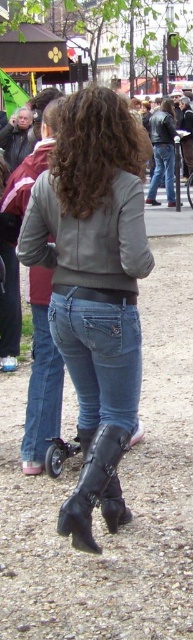
Question: Is leather jacket at center positioned in front of jeans at center?

Choices:
 (A) no
 (B) yes

Answer: (B)

Question: Estimate the real-world distances between objects in this image. Which object is closer to the blue denim jeans at center?

Choices:
 (A) denim at center
 (B) leather jacket at center
 (C) jeans at center

Answer: (A)

Question: Is jeans at center in front of black leather boot at lower center?

Choices:
 (A) yes
 (B) no

Answer: (B)

Question: Which point is closer to the camera taking this photo?

Choices:
 (A) (166, 152)
 (B) (126, 397)

Answer: (B)

Question: Which point appears closest to the camera in this image?

Choices:
 (A) (44, 428)
 (B) (66, 513)
 (C) (95, 484)

Answer: (B)

Question: Does jeans at center have a larger size compared to blue denim jeans at center?

Choices:
 (A) yes
 (B) no

Answer: (B)